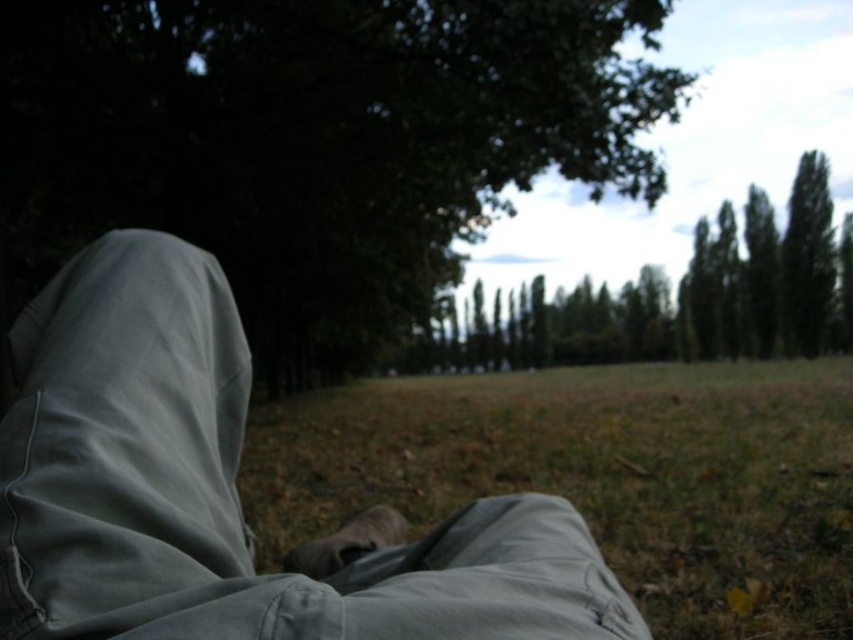
You are a photographer trying to capture the light gray pants at center and the green grass at lower center in a single shot. Which object should you adjust your camera angle to focus on first if you want to ensure both are in the frame?

The light gray pants at center is positioned on the left side of green grass at lower center, so you should focus on the green grass at lower center first to ensure both are in the frame.

Looking at this image, you are a photographer setting up a shot. You want to ensure the light gray pants at center and the green grass at lower center are both in focus. Given that your camera can only focus on objects within a 10 feet range, will both be in focus?

The light gray pants at center and green grass at lower center are 9.79 feet apart from each other. Since the distance between them is within the 10 feet range, both will be in focus.